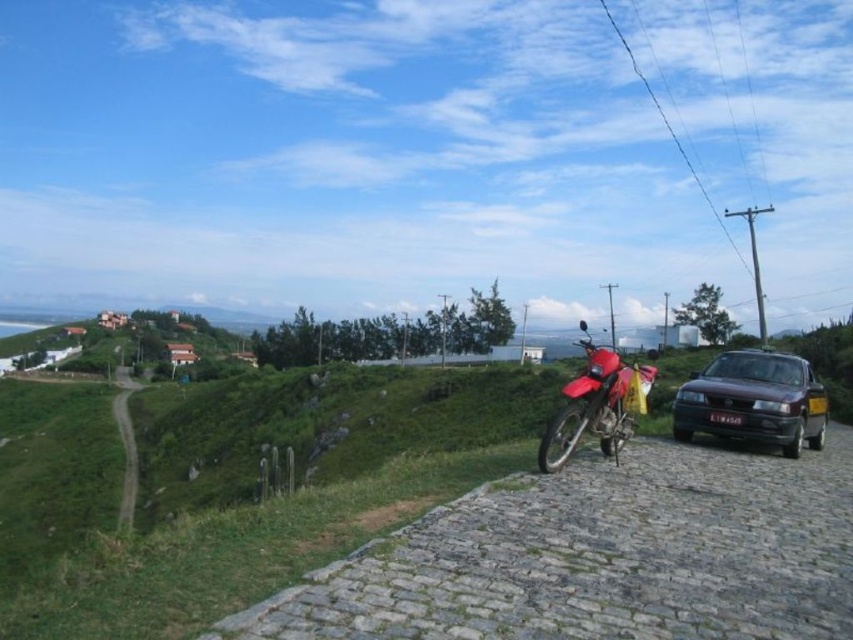
Question: Considering the real-world distances, which object is farthest from the black plastic license plate at right?

Choices:
 (A) shiny red motorcycle at center
 (B) black plastic license plate at center
 (C) red matte motorcycle at center
 (D) maroon metallic sedan at right

Answer: (C)

Question: Which of these objects is positioned farthest from the black plastic license plate at right?

Choices:
 (A) shiny red motorcycle at center
 (B) red matte motorcycle at center
 (C) black plastic license plate at center
 (D) maroon metallic sedan at right

Answer: (B)

Question: Is maroon metallic sedan at right above black plastic license plate at right?

Choices:
 (A) yes
 (B) no

Answer: (A)

Question: Among these objects, which one is nearest to the camera?

Choices:
 (A) black plastic license plate at center
 (B) black plastic license plate at right

Answer: (A)

Question: In this image, where is maroon metallic sedan at right located relative to black plastic license plate at center?

Choices:
 (A) right
 (B) left

Answer: (A)

Question: Can you confirm if maroon metallic sedan at right is thinner than black plastic license plate at center?

Choices:
 (A) no
 (B) yes

Answer: (A)